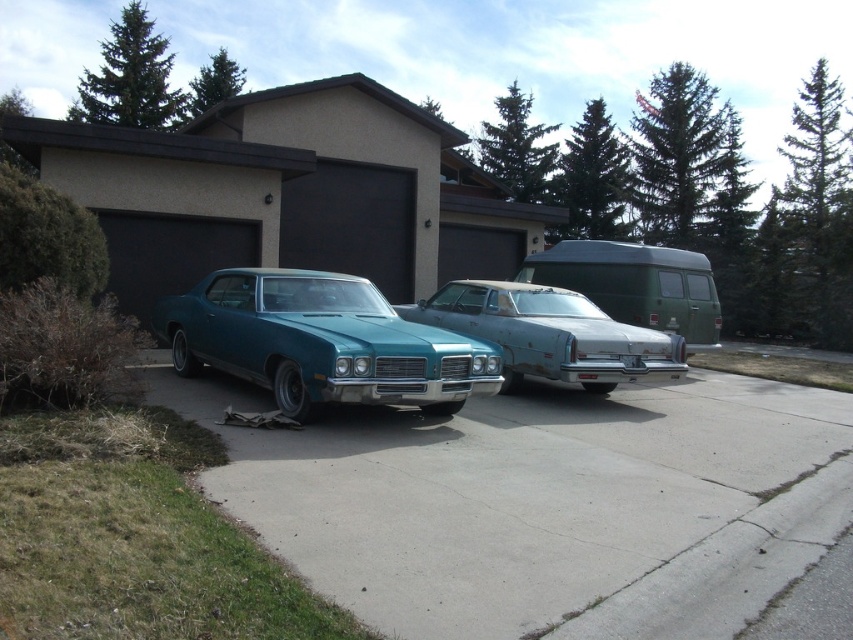
Can you confirm if concrete at center is shorter than teal glossy car at center?

Yes, concrete at center is shorter than teal glossy car at center.

Is concrete at center closer to the viewer compared to teal glossy car at center?

Yes.

Is point (584, 566) farther from viewer compared to point (288, 388)?

No, (584, 566) is closer to viewer.

The width and height of the screenshot is (853, 640). Identify the location of concrete at center. (543, 502).

Can you confirm if teal glossy car at center is positioned above silver metallic sedan at center?

No, teal glossy car at center is not above silver metallic sedan at center.

Which is more to the left, teal glossy car at center or silver metallic sedan at center?

Positioned to the left is teal glossy car at center.

Measure the distance between point (309, 376) and camera.

Point (309, 376) and camera are 6.99 meters apart from each other.

You are a GUI agent. You are given a task and a screenshot of the screen. Output one action in this format:
    pyautogui.click(x=<x>, y=<y>)
    Task: Click on the teal glossy car at center
    
    Given the screenshot: What is the action you would take?
    pyautogui.click(x=321, y=342)

Who is more distant from viewer, (436,307) or (654,291)?

The point (654,291) is behind.

Can you confirm if silver metallic sedan at center is positioned to the right of green matte van at center?

In fact, silver metallic sedan at center is to the left of green matte van at center.

Does point (450, 301) come closer to viewer compared to point (630, 257)?

Yes.

Locate an element on the screen. This screenshot has width=853, height=640. silver metallic sedan at center is located at coordinates (550, 333).